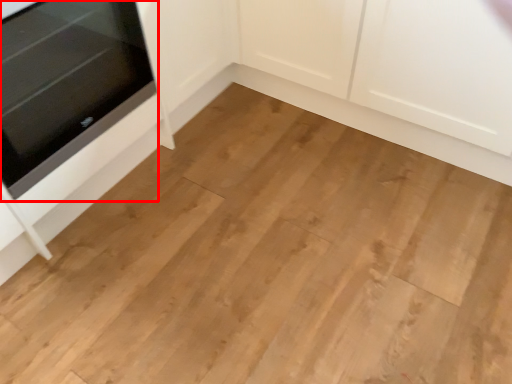
Question: In this image, where is oven (annotated by the red box) located relative to cabinetry?

Choices:
 (A) left
 (B) right

Answer: (A)